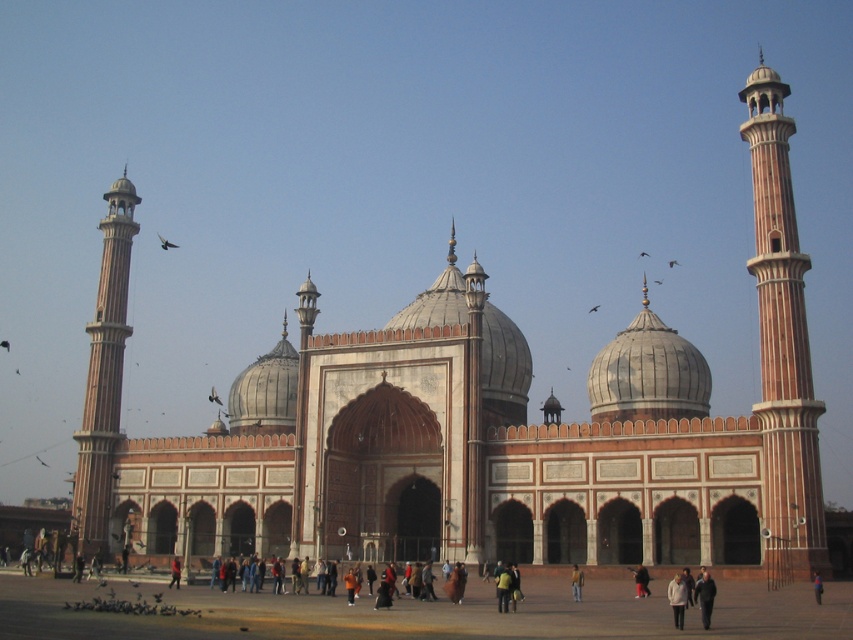
Which is more to the right, reddish-brown stone minaret at right or orange fabric jacket at center?

Positioned to the right is reddish-brown stone minaret at right.

Which is behind, point (773, 131) or point (573, 593)?

The point (773, 131) is more distant.

Which is behind, point (778, 481) or point (576, 600)?

Point (778, 481)

Find the location of `reddish-brown stone minaret at right`. reddish-brown stone minaret at right is located at coordinates (782, 344).

Does reddish-brown stone minaret at left have a greater height compared to orange fabric jacket at center?

Indeed, reddish-brown stone minaret at left has a greater height compared to orange fabric jacket at center.

Does reddish-brown stone minaret at left come in front of orange fabric jacket at center?

No, reddish-brown stone minaret at left is behind orange fabric jacket at center.

What do you see at coordinates (103, 376) in the screenshot? I see `reddish-brown stone minaret at left` at bounding box center [103, 376].

Identify the location of reddish-brown stone minaret at left. This screenshot has width=853, height=640. (103, 376).

Is orange fabric jacket at center bigger than blue fabric person at center?

Yes.

Who is more distant from viewer, [573,596] or [817,592]?

Positioned behind is point [573,596].

Image resolution: width=853 pixels, height=640 pixels. What are the coordinates of `orange fabric jacket at center` in the screenshot? It's located at (576, 582).

Image resolution: width=853 pixels, height=640 pixels. What are the coordinates of `orange fabric jacket at center` in the screenshot? It's located at (576, 582).